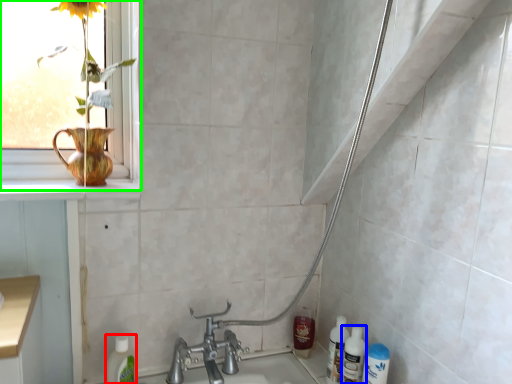
Question: Which is farther away from cleaning product (highlighted by a red box)? cleaning product (highlighted by a blue box) or window (highlighted by a green box)?

Choices:
 (A) cleaning product
 (B) window

Answer: (A)